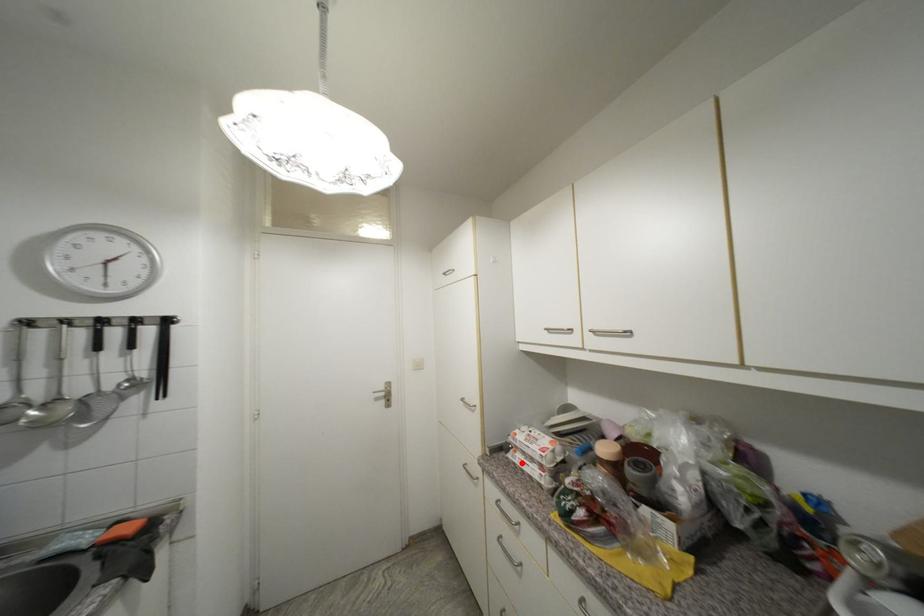
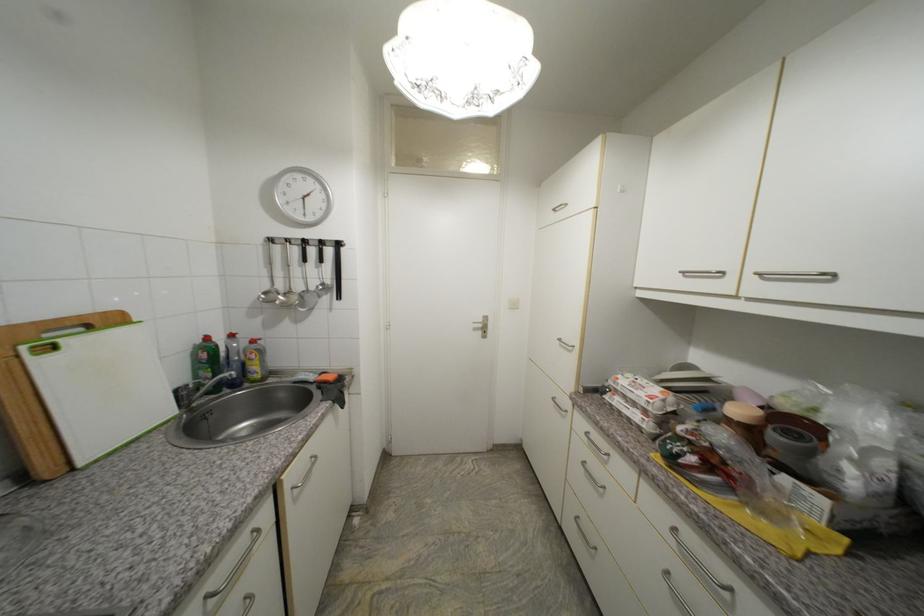
Question: I am providing you with two images of the same scene from different viewpoints. In image1, a red point is highlighted. Considering the same 3D point in image2, which of the following is correct?

Choices:
 (A) It is closer
 (B) It is farther

Answer: (A)